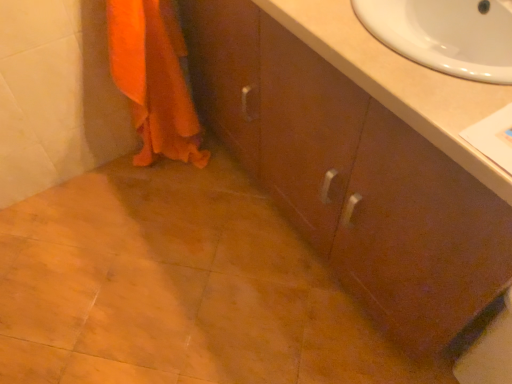
Question: Is matte brown cabinet at center completely or partially inside orange fabric towel at lower left?

Choices:
 (A) no
 (B) yes

Answer: (A)

Question: Would you say orange fabric towel at lower left is a long distance from matte brown cabinet at center?

Choices:
 (A) yes
 (B) no

Answer: (B)

Question: From a real-world perspective, is orange fabric towel at lower left beneath matte brown cabinet at center?

Choices:
 (A) yes
 (B) no

Answer: (A)

Question: Does orange fabric towel at lower left appear on the left side of matte brown cabinet at center?

Choices:
 (A) yes
 (B) no

Answer: (A)

Question: Is orange fabric towel at lower left closer to the viewer compared to matte brown cabinet at center?

Choices:
 (A) yes
 (B) no

Answer: (B)

Question: Can you confirm if orange fabric towel at lower left is bigger than matte brown cabinet at center?

Choices:
 (A) no
 (B) yes

Answer: (A)

Question: Is matte brown cabinet at center shorter than orange fabric towel at lower left?

Choices:
 (A) yes
 (B) no

Answer: (B)

Question: Is matte brown cabinet at center far away from orange fabric towel at lower left?

Choices:
 (A) no
 (B) yes

Answer: (A)

Question: Is matte brown cabinet at center thinner than orange fabric towel at lower left?

Choices:
 (A) no
 (B) yes

Answer: (A)

Question: Does matte brown cabinet at center appear on the right side of orange fabric towel at lower left?

Choices:
 (A) yes
 (B) no

Answer: (A)

Question: Is matte brown cabinet at center not inside orange fabric towel at lower left?

Choices:
 (A) yes
 (B) no

Answer: (A)

Question: Can you confirm if matte brown cabinet at center is bigger than orange fabric towel at lower left?

Choices:
 (A) yes
 (B) no

Answer: (A)

Question: Can you confirm if matte brown cabinet at center is shorter than beige laminate sink at upper right?

Choices:
 (A) yes
 (B) no

Answer: (B)